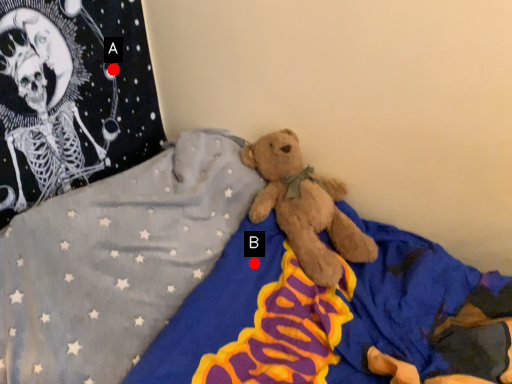
Question: Two points are circled on the image, labeled by A and B beside each circle. Which point appears farthest from the camera in this image?

Choices:
 (A) A is further
 (B) B is further

Answer: (A)